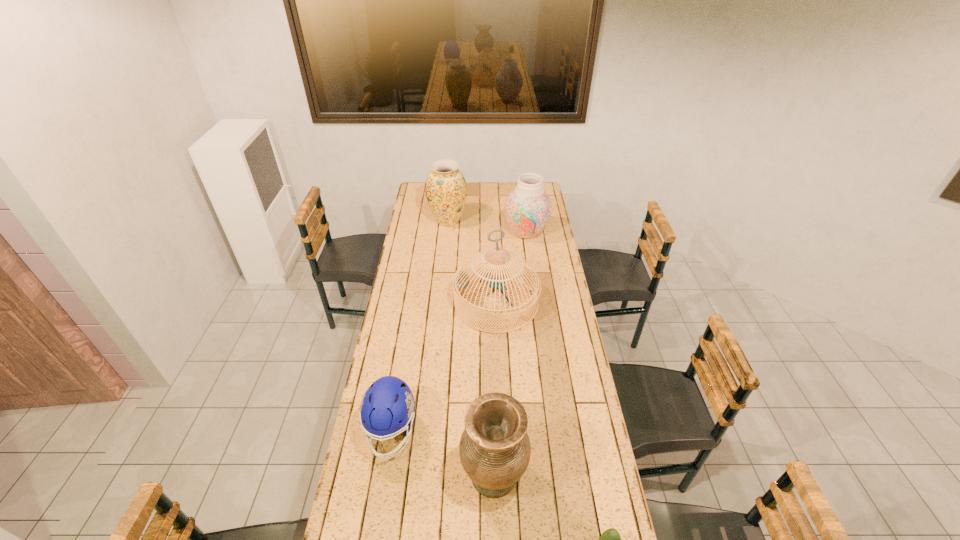
Image resolution: width=960 pixels, height=540 pixels. What are the coordinates of `birdcage located at the right edge` in the screenshot? It's located at (461, 281).

The image size is (960, 540). Find the location of `vase present at the right edge`. vase present at the right edge is located at coordinates (528, 208).

In the image, there is a desktop. Where is `vacant space at the left edge`? The image size is (960, 540). vacant space at the left edge is located at coordinates (430, 254).

Identify the location of free space at the right edge of the desktop. (559, 267).

Where is `free space between the football helmet and the fourth nearest object`? The height and width of the screenshot is (540, 960). free space between the football helmet and the fourth nearest object is located at coordinates pos(444,367).

Locate an element on the screen. This screenshot has width=960, height=540. free space that is in between the fifth tallest object and the birdcage is located at coordinates (444, 367).

Image resolution: width=960 pixels, height=540 pixels. I want to click on vacant space in between the leftmost vase and the nearest vase, so click(471, 348).

Identify which object is located as the nearest to the nearest vase. Please provide its 2D coordinates. Your answer should be formatted as a tuple, i.e. [(x, y)], where the tuple contains the x and y coordinates of a point satisfying the conditions above.

[(388, 406)]

The width and height of the screenshot is (960, 540). In order to click on object identified as the third closest to the nearest object in this screenshot , I will do `click(461, 281)`.

Where is `the closest vase to the avocado`? the closest vase to the avocado is located at coordinates (494, 448).